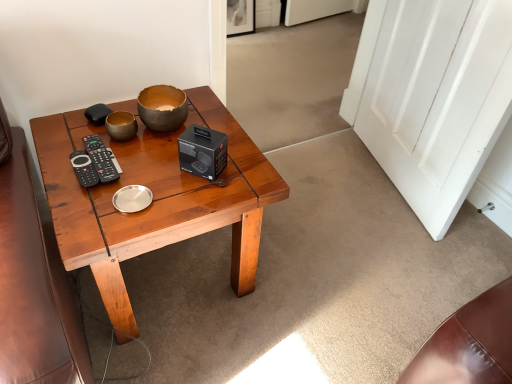
Find the location of a particular element. vacant space to the right of black plastic remote at left is located at coordinates (151, 173).